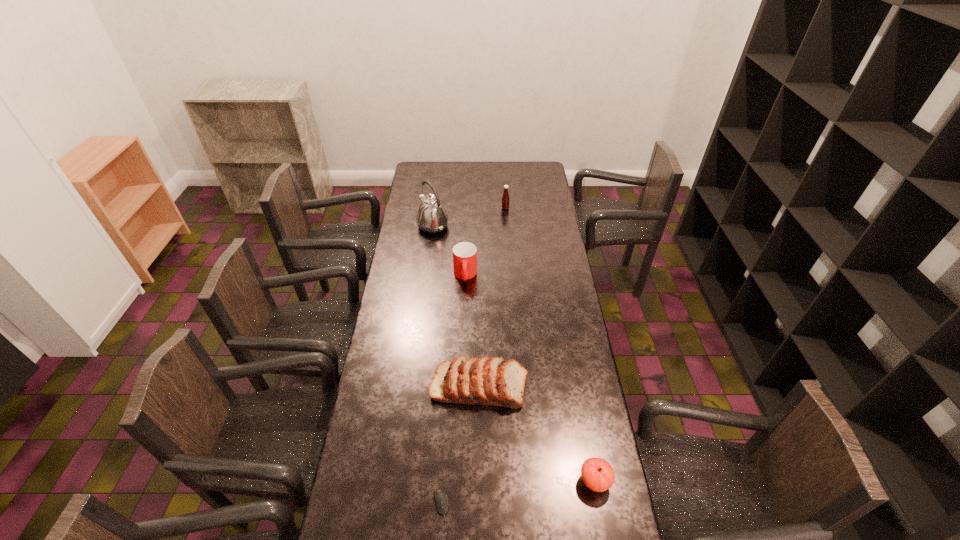
Locate an element on the screen. free space between the apple and the computer mouse is located at coordinates (517, 494).

What are the coordinates of `vacant region between the computer mouse and the rightmost object` in the screenshot? It's located at (517, 494).

Find the location of `vacant space that's between the cup and the farthest object`. vacant space that's between the cup and the farthest object is located at coordinates (485, 242).

The width and height of the screenshot is (960, 540). What are the coordinates of `free space between the computer mouse and the apple` in the screenshot? It's located at (517, 494).

The width and height of the screenshot is (960, 540). I want to click on vacant area between the fourth farthest object and the kettle, so click(456, 306).

Where is `vacant space in between the fourth nearest object and the apple`? The image size is (960, 540). vacant space in between the fourth nearest object and the apple is located at coordinates (530, 379).

Identify the location of free area in between the bread and the computer mouse. This screenshot has width=960, height=540. pos(460,446).

This screenshot has height=540, width=960. Find the location of `vacant region between the Tabasco sauce and the apple`. vacant region between the Tabasco sauce and the apple is located at coordinates (550, 345).

Image resolution: width=960 pixels, height=540 pixels. Identify the location of object that stands as the second closest to the farthest object. (464, 254).

The height and width of the screenshot is (540, 960). I want to click on object that ranks as the fourth closest to the kettle, so click(x=440, y=496).